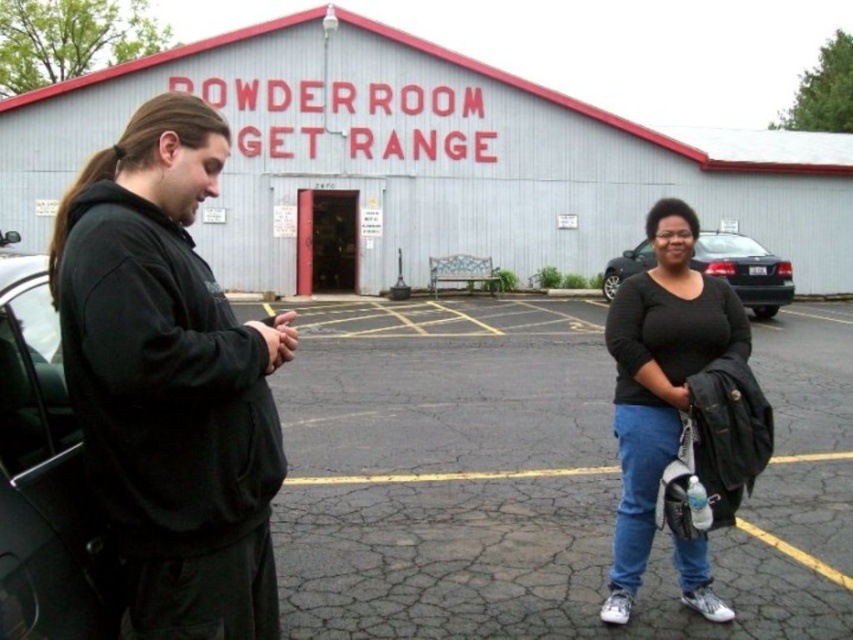
You are standing at the entrance of the building and want to place a 5 meter long banner from the black asphalt parking lot at center to the black matte hoodie at left. Is this possible?

The distance between the black asphalt parking lot at center and the black matte hoodie at left is 5.36 meters, so yes, the banner can be placed as it is slightly longer than the required distance.

You are a delivery person who needs to deliver a package to the building with the red door. You have a ladder that is 2 meters tall. The black matte hoodie at left and the black matte car at left are in your way. Which object do you need to move to ensure the ladder can pass through the narrow path between them?

The black matte hoodie at left is taller than the black matte car at left. Since the ladder is 2 meters tall, you need to move the black matte hoodie at left to ensure the ladder can pass through the narrow path between them.

Consider the image. You are a delivery person trying to park your vehicle in the black asphalt parking lot at center. However, there is a black matte hoodie at left blocking the entrance. Can you drive through the parking lot at center without hitting the person?

The black asphalt parking lot at center is in front of the black matte hoodie at left, meaning the person is in front of the parking lot entrance. Therefore, you cannot drive through the parking lot at center without hitting the black matte hoodie at left.